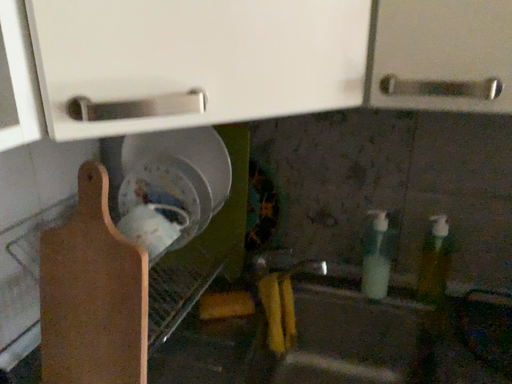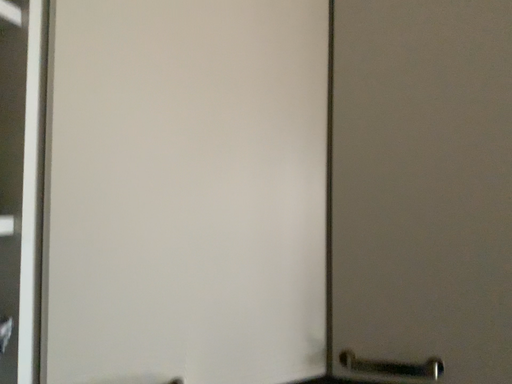
Question: How did the camera likely rotate when shooting the video?

Choices:
 (A) rotated upward
 (B) rotated downward

Answer: (A)